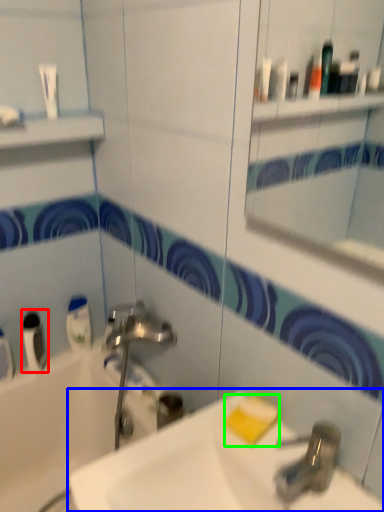
Question: Which object is the closest to the mouthwash (highlighted by a red box)? Choose among these: sink (highlighted by a blue box) or soap (highlighted by a green box).

Choices:
 (A) sink
 (B) soap

Answer: (A)